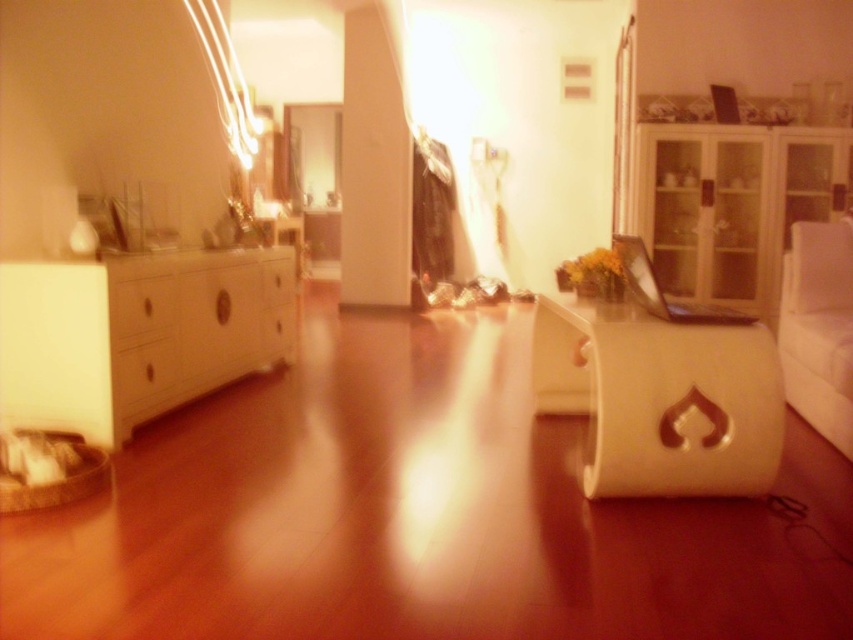
You are organizing a small party and need to place a large centerpiece on one of the available surfaces. Based on the scene, which object between the transparent glass cabinet at right and the white glossy drawer at center can accommodate a larger item?

The transparent glass cabinet at right is bigger than the white glossy drawer at center, so it can accommodate a larger item.

You are sitting on the white fabric couch at right and want to place a book on the white glossy drawer at center. Can you reach it from your current position without moving your feet?

The white fabric couch at right is below the white glossy drawer at center, so you can reach the white glossy drawer at center from the couch without needing to move your feet since it is positioned above you.

You are standing in the living room and want to reach the point marked as point (776, 259). If you can walk 5 meters in 1 minute, how long will it take you to reach that point?

The distance between you and point (776, 259) is 4.83 meters. Since you can walk 5 meters in 1 minute, it will take approximately 58 seconds to reach the point.